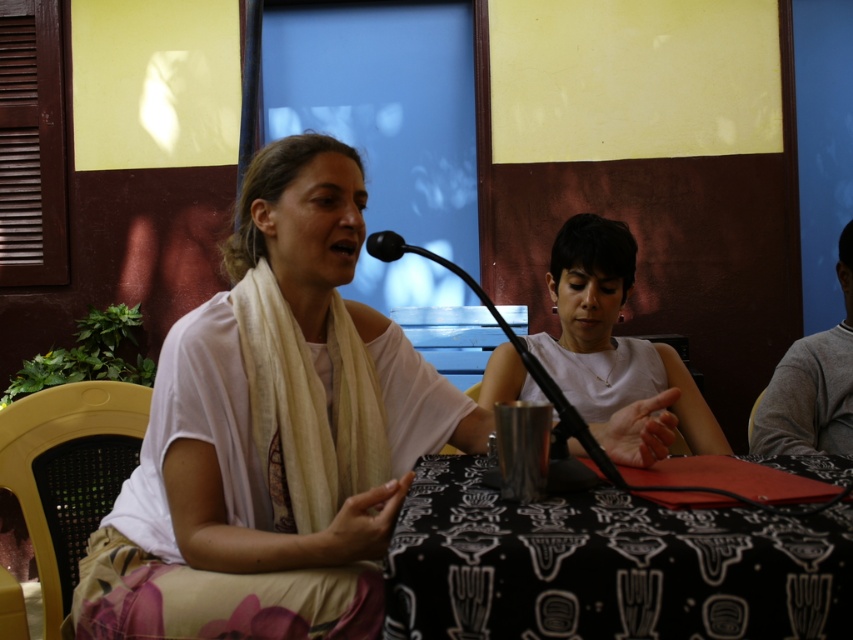
In the scene shown: Can you confirm if white cotton scarf at center is positioned to the left of white matte shirt at center?

Correct, you'll find white cotton scarf at center to the left of white matte shirt at center.

Does white cotton scarf at center have a larger size compared to white matte shirt at center?

Indeed, white cotton scarf at center has a larger size compared to white matte shirt at center.

This screenshot has height=640, width=853. What do you see at coordinates (273, 433) in the screenshot?
I see `white cotton scarf at center` at bounding box center [273, 433].

Identify the location of white cotton scarf at center. (273, 433).

Is black patterned table at center positioned before gray sweater at right?

Yes, black patterned table at center is in front of gray sweater at right.

Between black patterned table at center and gray sweater at right, which one is positioned lower?

black patterned table at center is lower down.

At what (x,y) coordinates should I click in order to perform the action: click on black patterned table at center. Please return your answer as a coordinate pair (x, y). The width and height of the screenshot is (853, 640). Looking at the image, I should click on (607, 564).

Find the location of a particular element. white matte shirt at center is located at coordinates (616, 352).